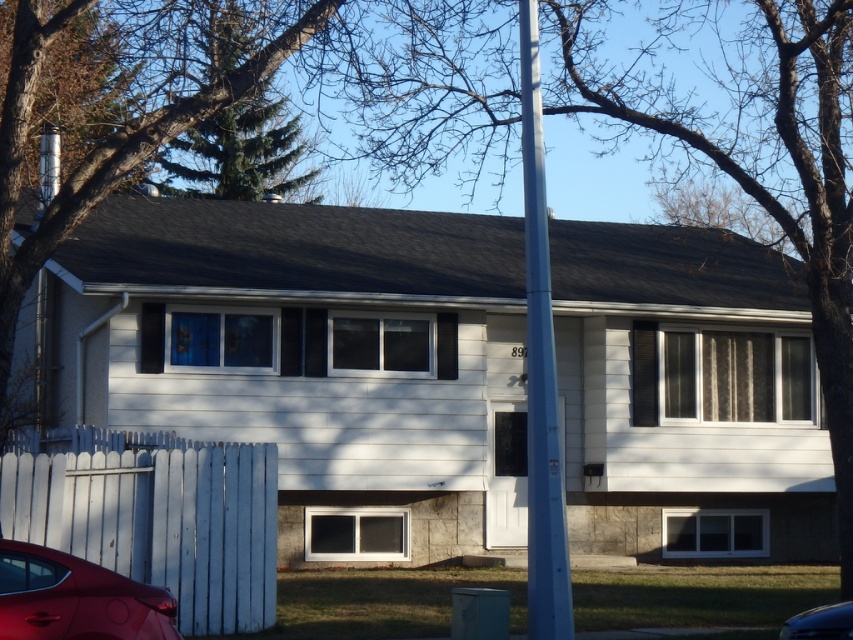
Question: Which of the following is the farthest from the observer?

Choices:
 (A) (99, 628)
 (B) (851, 612)
 (C) (531, 554)
 (D) (103, 518)

Answer: (D)

Question: Is shiny red sedan at lower left positioned before metallic silver car at lower right?

Choices:
 (A) no
 (B) yes

Answer: (B)

Question: Among these points, which one is farthest from the camera?

Choices:
 (A) (152, 628)
 (B) (531, 99)

Answer: (B)

Question: Is blue metallic pole at center further to camera compared to metallic silver car at lower right?

Choices:
 (A) no
 (B) yes

Answer: (B)

Question: Is white wooden fence at lower left to the right of metallic silver car at lower right from the viewer's perspective?

Choices:
 (A) yes
 (B) no

Answer: (B)

Question: Which of the following is the closest to the observer?

Choices:
 (A) (540, 556)
 (B) (814, 614)

Answer: (B)